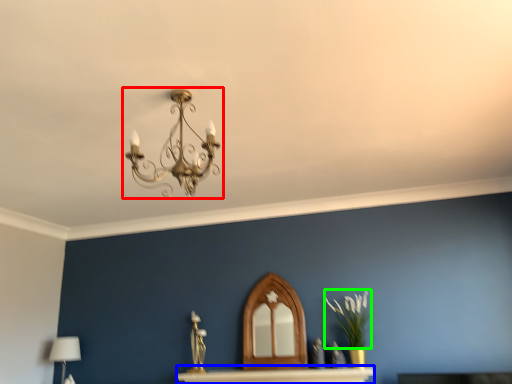
Question: Estimate the real-world distances between objects in this image. Which object is closer to lamp (highlighted by a red box), table (highlighted by a blue box) or plant (highlighted by a green box)?

Choices:
 (A) table
 (B) plant

Answer: (A)